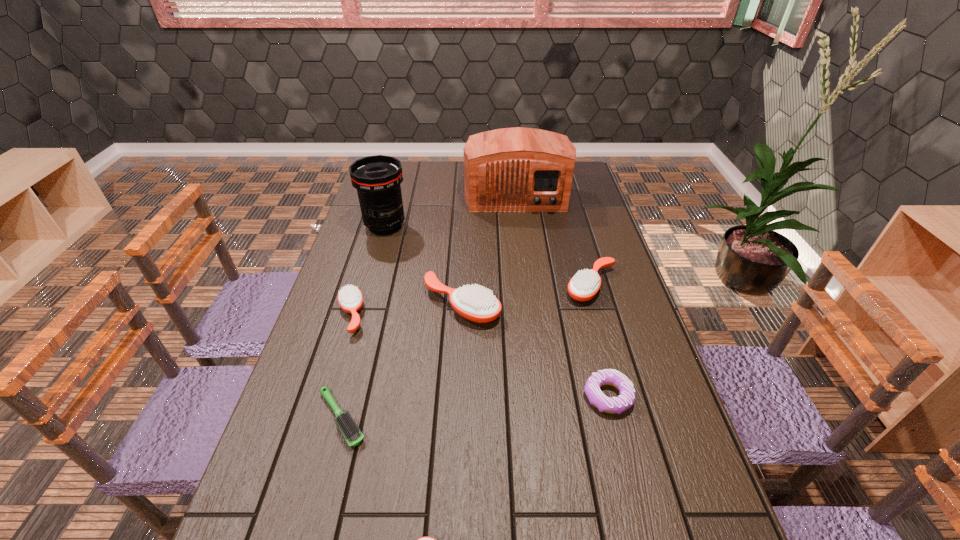
Image resolution: width=960 pixels, height=540 pixels. I want to click on radio receiver, so click(518, 169).

Find the location of a particular element. telephoto lens is located at coordinates (377, 179).

This screenshot has height=540, width=960. I want to click on the third tallest object, so tap(473, 302).

The image size is (960, 540). What are the coordinates of `the biggest orange hairbrush` in the screenshot? It's located at (473, 302).

Identify the location of the second biggest orange hairbrush. The height and width of the screenshot is (540, 960). (585, 284).

Image resolution: width=960 pixels, height=540 pixels. I want to click on the second tallest hairbrush, so click(x=585, y=284).

At what (x,y) coordinates should I click in order to perform the action: click on the third biggest orange hairbrush. Please return your answer as a coordinate pair (x, y). This screenshot has height=540, width=960. Looking at the image, I should click on (350, 298).

I want to click on the third shortest hairbrush, so click(350, 298).

Identify the location of doughnut. (615, 405).

Where is `the shortest hairbrush`? the shortest hairbrush is located at coordinates (349, 429).